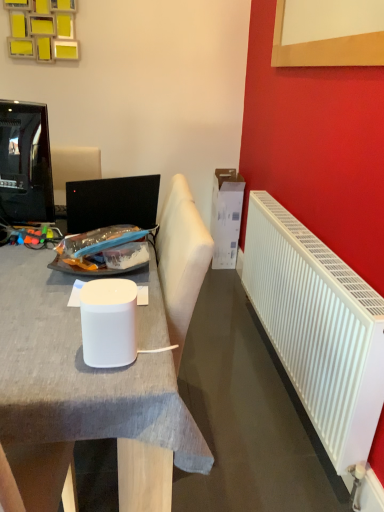
This screenshot has width=384, height=512. Identify the location of free point below matte black television at left (from a real-world perspective). (21, 241).